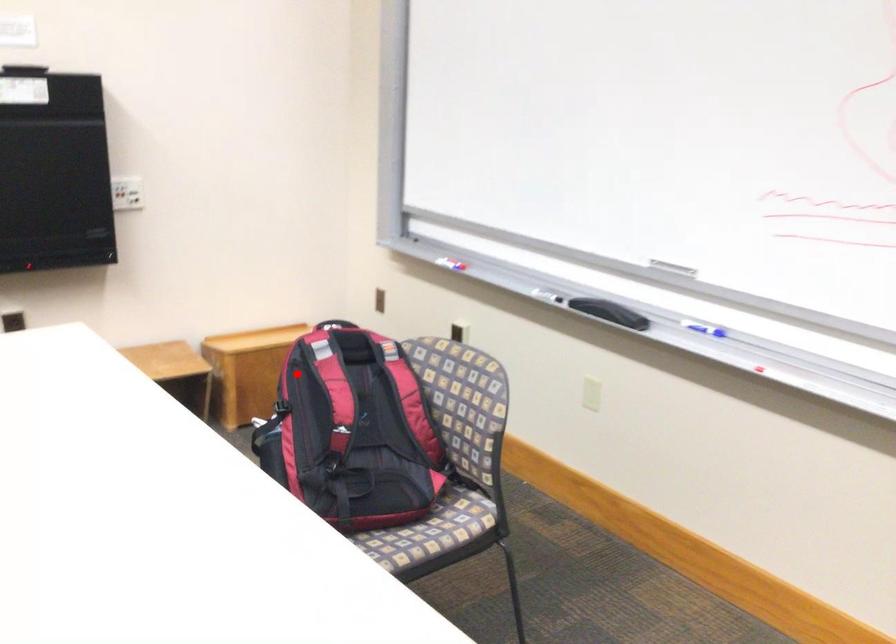
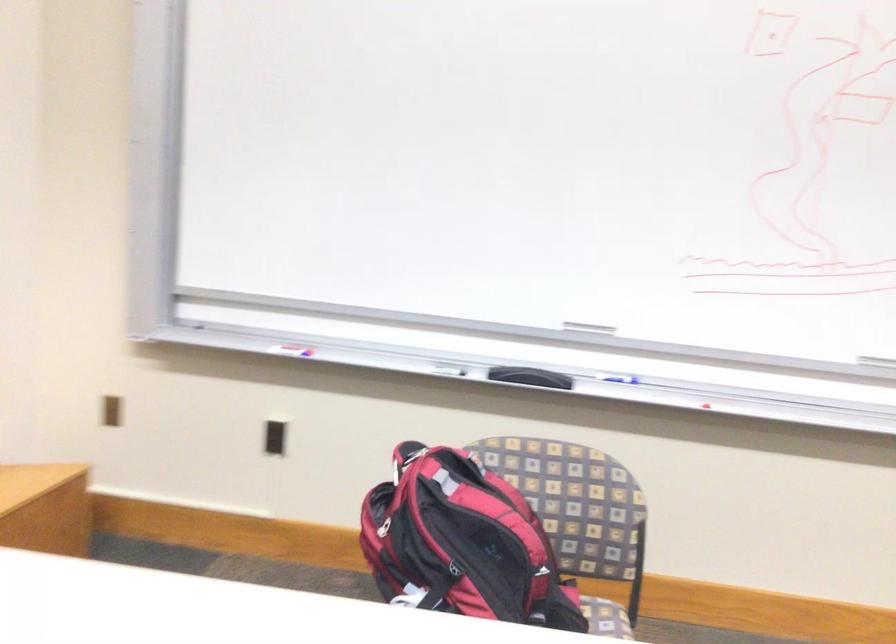
Where in the second image is the point corresponding to the highlighted location from the first image?

(383, 527)